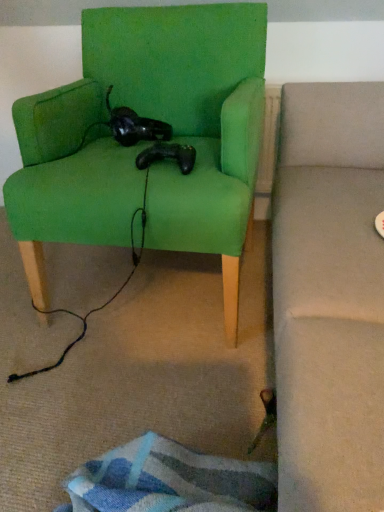
Question: Considering the relative positions of green fabric chair at center and black matte controller at center in the image provided, is green fabric chair at center to the left of black matte controller at center from the viewer's perspective?

Choices:
 (A) no
 (B) yes

Answer: (B)

Question: Considering the relative positions of green fabric chair at center and black matte controller at center in the image provided, is green fabric chair at center in front of black matte controller at center?

Choices:
 (A) yes
 (B) no

Answer: (A)

Question: Considering the relative sizes of green fabric chair at center and black matte controller at center in the image provided, is green fabric chair at center smaller than black matte controller at center?

Choices:
 (A) no
 (B) yes

Answer: (A)

Question: Is green fabric chair at center in contact with black matte controller at center?

Choices:
 (A) no
 (B) yes

Answer: (A)

Question: From a real-world perspective, is green fabric chair at center on top of black matte controller at center?

Choices:
 (A) no
 (B) yes

Answer: (A)

Question: Is green fabric chair at center not near black matte controller at center?

Choices:
 (A) no
 (B) yes

Answer: (A)

Question: Can you confirm if black matte controller at center is shorter than green fabric chair at center?

Choices:
 (A) no
 (B) yes

Answer: (B)

Question: Is black matte controller at center located outside green fabric chair at center?

Choices:
 (A) yes
 (B) no

Answer: (B)

Question: Is the depth of black matte controller at center less than that of green fabric chair at center?

Choices:
 (A) no
 (B) yes

Answer: (A)

Question: Does black matte controller at center come behind green fabric chair at center?

Choices:
 (A) no
 (B) yes

Answer: (B)

Question: Can you confirm if black matte controller at center is wider than green fabric chair at center?

Choices:
 (A) yes
 (B) no

Answer: (B)

Question: Is the surface of black matte controller at center in direct contact with green fabric chair at center?

Choices:
 (A) yes
 (B) no

Answer: (B)

Question: From the image's perspective, is green fabric chair at center above or below black matte controller at center?

Choices:
 (A) below
 (B) above

Answer: (B)